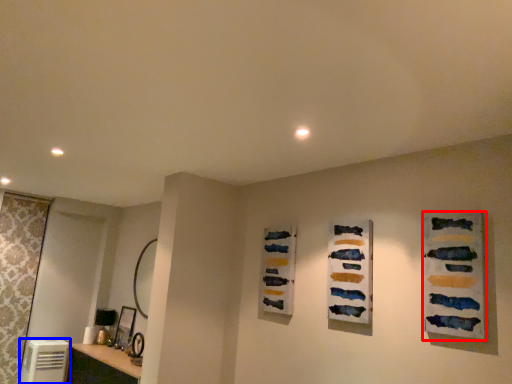
Question: Which of the following is the closest to the observer, art (highlighted by a red box) or appliance (highlighted by a blue box)?

Choices:
 (A) art
 (B) appliance

Answer: (A)